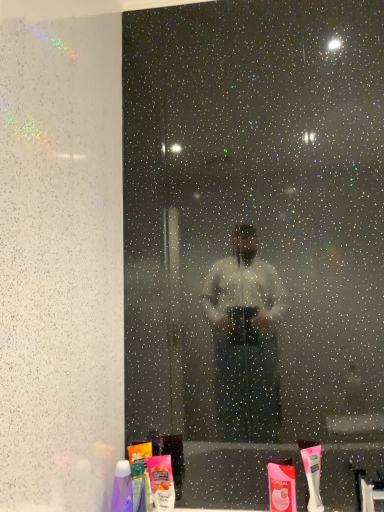
The image size is (384, 512). Find the location of `purple glossy bottle at lower left, which appears as the 3th toiletry when viewed from the right`. purple glossy bottle at lower left, which appears as the 3th toiletry when viewed from the right is located at coordinates (122, 488).

The height and width of the screenshot is (512, 384). What do you see at coordinates (161, 482) in the screenshot? I see `pink matte lotion at lower center, which is counted as the second toiletry, starting from the right` at bounding box center [161, 482].

At what (x,y) coordinates should I click in order to perform the action: click on purple glossy bottle at lower left, which appears as the 3th toiletry when viewed from the right. Please return your answer as a coordinate pair (x, y). Looking at the image, I should click on (122, 488).

From a real-world perspective, is pink matte lotion at lower center, marked as the second toiletry in a left-to-right arrangement, positioned under matte pink plastic toothpaste at lower center, arranged as the first toiletry when viewed from the right, based on gravity?

No.

Locate an element on the screen. the 1st toiletry located above the matte pink plastic toothpaste at lower center, which is the 3th toiletry from left to right (from a real-world perspective) is located at coordinates (161, 482).

Which point is more forward, (281, 494) or (305, 470)?

Point (305, 470)

Considering the sizes of objects matte pink plastic toothpaste at lower center, arranged as the first toiletry when viewed from the right, and white plastic toothbrush at lower right in the image provided, who is bigger, matte pink plastic toothpaste at lower center, arranged as the first toiletry when viewed from the right, or white plastic toothbrush at lower right?

white plastic toothbrush at lower right is bigger.

From the image's perspective, which one is positioned higher, matte pink plastic toothpaste at lower center, which is the 3th toiletry from left to right, or white plastic toothbrush at lower right?

white plastic toothbrush at lower right is shown above in the image.

From a real-world perspective, is translucent plastic mouthwash at lower center on white plastic toothbrush at lower right?

No, from a real-world perspective, translucent plastic mouthwash at lower center is not above white plastic toothbrush at lower right.

Is translucent plastic mouthwash at lower center wider or thinner than white plastic toothbrush at lower right?

In the image, translucent plastic mouthwash at lower center appears to be wider than white plastic toothbrush at lower right.

Is translucent plastic mouthwash at lower center turned away from white plastic toothbrush at lower right?

No, translucent plastic mouthwash at lower center's orientation is not away from white plastic toothbrush at lower right.

From the image's perspective, is translucent plastic mouthwash at lower center on white plastic toothbrush at lower right?

No.

From the image's perspective, which object appears higher, translucent plastic mouthwash at lower center or purple glossy bottle at lower left, which appears as the 3th toiletry when viewed from the right?

purple glossy bottle at lower left, which appears as the 3th toiletry when viewed from the right, is shown above in the image.

Is translucent plastic mouthwash at lower center situated inside purple glossy bottle at lower left, arranged as the 1th toiletry when viewed from the left, or outside?

translucent plastic mouthwash at lower center is spatially situated outside purple glossy bottle at lower left, arranged as the 1th toiletry when viewed from the left.

Considering the relative sizes of translucent plastic mouthwash at lower center and purple glossy bottle at lower left, arranged as the 1th toiletry when viewed from the left, in the image provided, is translucent plastic mouthwash at lower center wider than purple glossy bottle at lower left, arranged as the 1th toiletry when viewed from the left,?

No.

Can you confirm if pink matte lotion at lower center, which is counted as the second toiletry, starting from the right, is bigger than translucent plastic mouthwash at lower center?

No, pink matte lotion at lower center, which is counted as the second toiletry, starting from the right, is not bigger than translucent plastic mouthwash at lower center.

Considering the positions of point (161, 508) and point (131, 460), is point (161, 508) closer or farther from the camera than point (131, 460)?

Point (161, 508) is positioned closer to the camera compared to point (131, 460).

Is the depth of pink matte lotion at lower center, marked as the second toiletry in a left-to-right arrangement, greater than that of translucent plastic mouthwash at lower center?

Yes, pink matte lotion at lower center, marked as the second toiletry in a left-to-right arrangement, is behind translucent plastic mouthwash at lower center.

Is pink matte lotion at lower center, marked as the second toiletry in a left-to-right arrangement, to the left of translucent plastic mouthwash at lower center from the viewer's perspective?

Incorrect, pink matte lotion at lower center, marked as the second toiletry in a left-to-right arrangement, is not on the left side of translucent plastic mouthwash at lower center.

In terms of size, does purple glossy bottle at lower left, which appears as the 3th toiletry when viewed from the right, appear bigger or smaller than pink matte lotion at lower center, which is counted as the second toiletry, starting from the right?

Clearly, purple glossy bottle at lower left, which appears as the 3th toiletry when viewed from the right, is larger in size than pink matte lotion at lower center, which is counted as the second toiletry, starting from the right.

From the image's perspective, which object appears higher, purple glossy bottle at lower left, arranged as the 1th toiletry when viewed from the left, or pink matte lotion at lower center, marked as the second toiletry in a left-to-right arrangement?

From the image's view, purple glossy bottle at lower left, arranged as the 1th toiletry when viewed from the left, is above.

Considering the sizes of objects purple glossy bottle at lower left, arranged as the 1th toiletry when viewed from the left, and pink matte lotion at lower center, which is counted as the second toiletry, starting from the right, in the image provided, who is shorter, purple glossy bottle at lower left, arranged as the 1th toiletry when viewed from the left, or pink matte lotion at lower center, which is counted as the second toiletry, starting from the right,?

Standing shorter between the two is pink matte lotion at lower center, which is counted as the second toiletry, starting from the right.

Considering the points (130, 483) and (162, 500), which point is in front, point (130, 483) or point (162, 500)?

Point (130, 483)

In the image, is translucent plastic mouthwash at lower center on the left side or the right side of matte pink plastic toothpaste at lower center, arranged as the first toiletry when viewed from the right?

Based on their positions, translucent plastic mouthwash at lower center is located to the left of matte pink plastic toothpaste at lower center, arranged as the first toiletry when viewed from the right.

Which is behind, point (147, 473) or point (286, 494)?

The point (286, 494) is farther.

Can you confirm if translucent plastic mouthwash at lower center is bigger than matte pink plastic toothpaste at lower center, arranged as the first toiletry when viewed from the right?

Yes.

Locate an element on the screen. This screenshot has height=512, width=384. toiletry behind the pink matte lotion at lower center, marked as the second toiletry in a left-to-right arrangement is located at coordinates (281, 486).

This screenshot has width=384, height=512. I want to click on toothbrush above the matte pink plastic toothpaste at lower center, arranged as the first toiletry when viewed from the right (from the image's perspective), so click(312, 473).

Estimate the real-world distances between objects in this image. Which object is further from translucent plastic mouthwash at lower center, white plastic toothbrush at lower right or pink matte lotion at lower center, marked as the second toiletry in a left-to-right arrangement?

Among the two, white plastic toothbrush at lower right is located further to translucent plastic mouthwash at lower center.

When comparing their distances from matte pink plastic toothpaste at lower center, arranged as the first toiletry when viewed from the right, does pink matte lotion at lower center, which is counted as the second toiletry, starting from the right, or purple glossy bottle at lower left, arranged as the 1th toiletry when viewed from the left, seem closer?

pink matte lotion at lower center, which is counted as the second toiletry, starting from the right, lies closer to matte pink plastic toothpaste at lower center, arranged as the first toiletry when viewed from the right, than the other object.

Looking at the image, which one is located closer to white plastic toothbrush at lower right, translucent plastic mouthwash at lower center or purple glossy bottle at lower left, arranged as the 1th toiletry when viewed from the left?

Based on the image, translucent plastic mouthwash at lower center appears to be nearer to white plastic toothbrush at lower right.

Based on their spatial positions, is pink matte lotion at lower center, marked as the second toiletry in a left-to-right arrangement, or translucent plastic mouthwash at lower center further from purple glossy bottle at lower left, which appears as the 3th toiletry when viewed from the right?

pink matte lotion at lower center, marked as the second toiletry in a left-to-right arrangement.

Consider the image. Based on their spatial positions, is matte pink plastic toothpaste at lower center, arranged as the first toiletry when viewed from the right, or translucent plastic mouthwash at lower center closer to white plastic toothbrush at lower right?

matte pink plastic toothpaste at lower center, arranged as the first toiletry when viewed from the right, is positioned closer to the anchor white plastic toothbrush at lower right.

When comparing their distances from matte pink plastic toothpaste at lower center, which is the 3th toiletry from left to right, does white plastic toothbrush at lower right or pink matte lotion at lower center, which is counted as the second toiletry, starting from the right, seem closer?

Based on the image, white plastic toothbrush at lower right appears to be nearer to matte pink plastic toothpaste at lower center, which is the 3th toiletry from left to right.

Consider the image. Based on their spatial positions, is white plastic toothbrush at lower right or pink matte lotion at lower center, marked as the second toiletry in a left-to-right arrangement, closer to purple glossy bottle at lower left, which appears as the 3th toiletry when viewed from the right?

pink matte lotion at lower center, marked as the second toiletry in a left-to-right arrangement, is positioned closer to the anchor purple glossy bottle at lower left, which appears as the 3th toiletry when viewed from the right.

When comparing their distances from purple glossy bottle at lower left, arranged as the 1th toiletry when viewed from the left, does pink matte lotion at lower center, marked as the second toiletry in a left-to-right arrangement, or matte pink plastic toothpaste at lower center, arranged as the first toiletry when viewed from the right, seem closer?

pink matte lotion at lower center, marked as the second toiletry in a left-to-right arrangement, lies closer to purple glossy bottle at lower left, arranged as the 1th toiletry when viewed from the left, than the other object.

At what (x,y) coordinates should I click in order to perform the action: click on mouthwash situated between purple glossy bottle at lower left, which appears as the 3th toiletry when viewed from the right, and white plastic toothbrush at lower right from left to right. Please return your answer as a coordinate pair (x, y). The height and width of the screenshot is (512, 384). Looking at the image, I should click on (140, 476).

Find the location of `mouthwash between purple glossy bottle at lower left, which appears as the 3th toiletry when viewed from the right, and pink matte lotion at lower center, marked as the second toiletry in a left-to-right arrangement, from left to right`. mouthwash between purple glossy bottle at lower left, which appears as the 3th toiletry when viewed from the right, and pink matte lotion at lower center, marked as the second toiletry in a left-to-right arrangement, from left to right is located at coordinates (140, 476).

At what (x,y) coordinates should I click in order to perform the action: click on toiletry situated between pink matte lotion at lower center, which is counted as the second toiletry, starting from the right, and white plastic toothbrush at lower right from left to right. Please return your answer as a coordinate pair (x, y). The image size is (384, 512). Looking at the image, I should click on (281, 486).

At what (x,y) coordinates should I click in order to perform the action: click on toiletry between purple glossy bottle at lower left, which appears as the 3th toiletry when viewed from the right, and matte pink plastic toothpaste at lower center, arranged as the first toiletry when viewed from the right, in the horizontal direction. Please return your answer as a coordinate pair (x, y). The image size is (384, 512). Looking at the image, I should click on (161, 482).